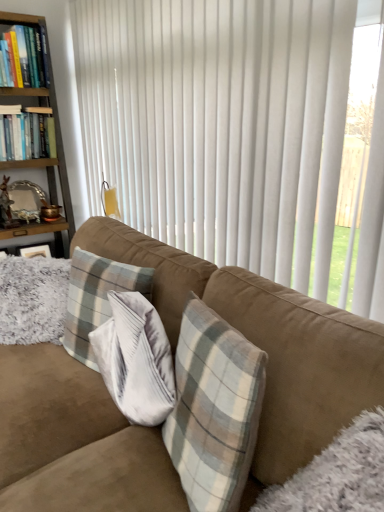
Question: Is hardcover book at upper left, the 1th book when ordered from top to bottom, closer to the viewer compared to hardcover books at left, the second book when ordered from top to bottom?

Choices:
 (A) no
 (B) yes

Answer: (B)

Question: Is hardcover book at upper left, the 1th book when ordered from top to bottom, bigger than hardcover books at left, the second book when ordered from top to bottom?

Choices:
 (A) yes
 (B) no

Answer: (B)

Question: From a real-world perspective, is hardcover book at upper left, the 1th book when ordered from top to bottom, located beneath hardcover books at left, which appears as the first book when ordered from the bottom?

Choices:
 (A) no
 (B) yes

Answer: (A)

Question: Are hardcover book at upper left, the 1th book when ordered from top to bottom, and hardcover books at left, the second book when ordered from top to bottom, far apart?

Choices:
 (A) no
 (B) yes

Answer: (A)

Question: Considering the relative sizes of hardcover book at upper left, which is the 2th book from bottom to top, and hardcover books at left, the second book when ordered from top to bottom, in the image provided, is hardcover book at upper left, which is the 2th book from bottom to top, thinner than hardcover books at left, the second book when ordered from top to bottom,?

Choices:
 (A) yes
 (B) no

Answer: (A)

Question: Which is correct: hardcover book at upper left, the 1th book when ordered from top to bottom, is inside wooden bookshelf at left, or outside of it?

Choices:
 (A) inside
 (B) outside

Answer: (A)

Question: Is hardcover book at upper left, the 1th book when ordered from top to bottom, taller or shorter than wooden bookshelf at left?

Choices:
 (A) short
 (B) tall

Answer: (A)

Question: Is point (39, 38) positioned closer to the camera than point (59, 250)?

Choices:
 (A) farther
 (B) closer

Answer: (B)

Question: From the image's perspective, is hardcover book at upper left, the 1th book when ordered from top to bottom, above or below wooden bookshelf at left?

Choices:
 (A) above
 (B) below

Answer: (A)

Question: Is wooden bookshelf at left wider or thinner than plaid fabric pillow at center?

Choices:
 (A) thin
 (B) wide

Answer: (B)

Question: Is wooden bookshelf at left to the left or to the right of plaid fabric pillow at center in the image?

Choices:
 (A) right
 (B) left

Answer: (B)

Question: In terms of size, does wooden bookshelf at left appear bigger or smaller than plaid fabric pillow at center?

Choices:
 (A) small
 (B) big

Answer: (B)

Question: From a real-world perspective, is wooden bookshelf at left physically located above or below plaid fabric pillow at center?

Choices:
 (A) above
 (B) below

Answer: (A)

Question: Would you say plaid fabric pillow at center is inside or outside hardcover book at upper left, which is the 2th book from bottom to top?

Choices:
 (A) outside
 (B) inside

Answer: (A)

Question: Considering their positions, is plaid fabric pillow at center located in front of or behind hardcover book at upper left, the 1th book when ordered from top to bottom?

Choices:
 (A) front
 (B) behind

Answer: (A)